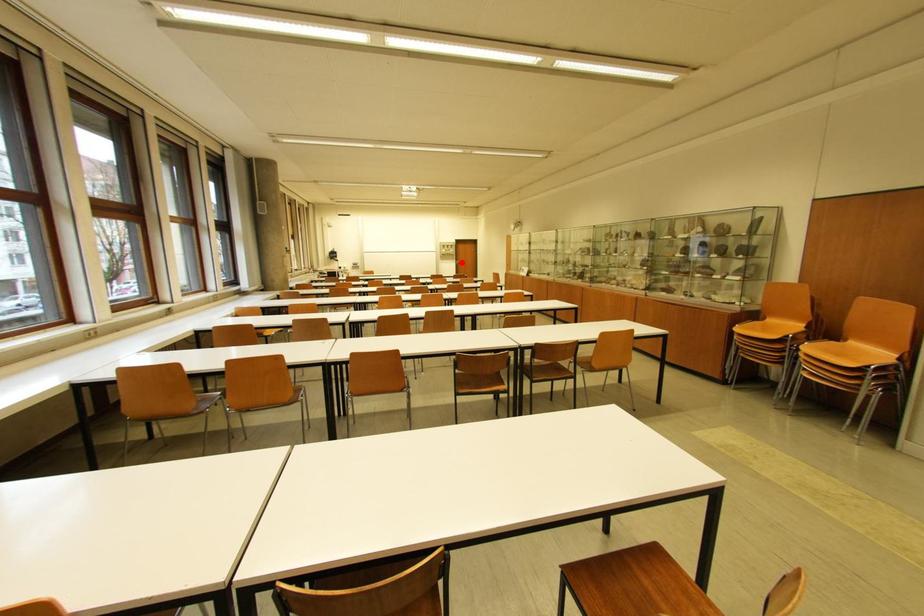
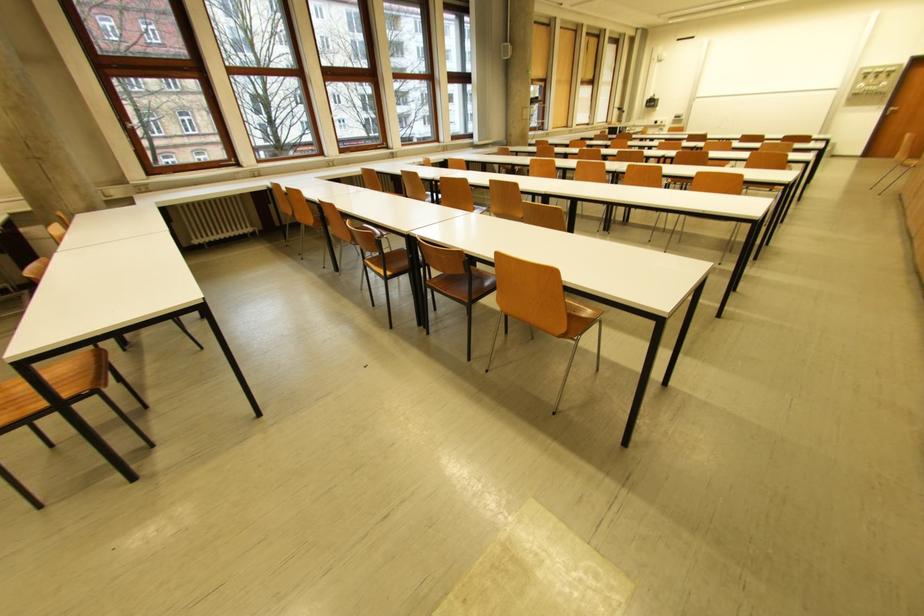
Locate, in the second image, the point that corresponds to the highlighted location in the first image.

(891, 108)